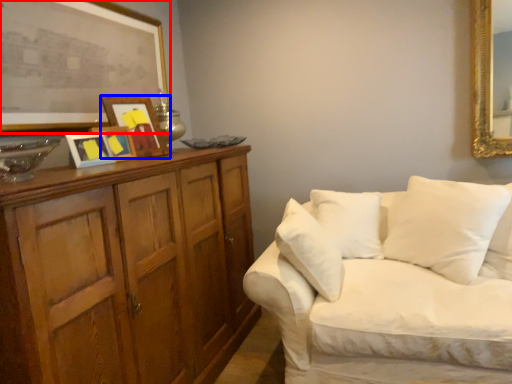
Question: Among these objects, which one is nearest to the camera, picture frame (highlighted by a red box) or picture frame (highlighted by a blue box)?

Choices:
 (A) picture frame
 (B) picture frame

Answer: (A)